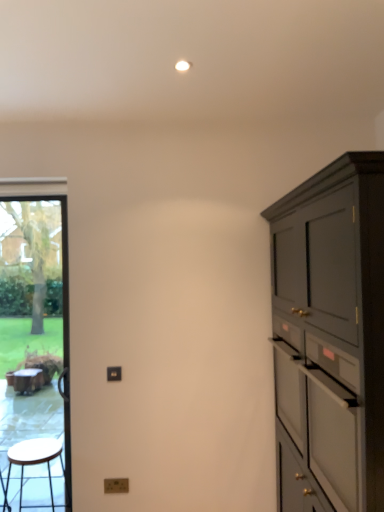
At what (x,y) coordinates should I click in order to perform the action: click on matte dark gray cabinet at right. Please return your answer as a coordinate pair (x, y). This screenshot has width=384, height=512. Looking at the image, I should click on (330, 337).

Identify the location of transparent glass door at left. This screenshot has width=384, height=512. (35, 323).

Measure the distance between transparent glass door at left and camera.

The depth of transparent glass door at left is 3.46 meters.

Locate an element on the screen. wooden stool at left is located at coordinates (34, 464).

From the image's perspective, is transparent glass door at left located beneath wooden stool at left?

No, from the image's perspective, transparent glass door at left is not beneath wooden stool at left.

Measure the distance from transparent glass door at left to wooden stool at left.

The distance of transparent glass door at left from wooden stool at left is 1.42 meters.

Who is shorter, transparent glass door at left or wooden stool at left?

wooden stool at left.

What's the angular difference between transparent glass door at left and wooden stool at left's facing directions?

They differ by 2.26 degrees in their facing directions.

Is point (369, 156) less distant than point (284, 429)?

Yes, point (369, 156) is closer to viewer.

From the image's perspective, is matte dark gray cabinet at right located above or below white matte drawer at right?

matte dark gray cabinet at right is situated lower than white matte drawer at right in the image.

Is matte dark gray cabinet at right to the left or to the right of white matte drawer at right in the image?

In the image, matte dark gray cabinet at right appears on the right side of white matte drawer at right.

Does matte dark gray cabinet at right turn towards white matte drawer at right?

Yes, matte dark gray cabinet at right is facing white matte drawer at right.

Does wooden stool at left turn towards matte dark gray cabinet at right?

No, wooden stool at left does not turn towards matte dark gray cabinet at right.

From the image's perspective, between wooden stool at left and matte dark gray cabinet at right, who is located below?

wooden stool at left appears lower in the image.

Is there a large distance between wooden stool at left and matte dark gray cabinet at right?

wooden stool at left is positioned a significant distance from matte dark gray cabinet at right.

Is wooden stool at left positioned beyond the bounds of matte dark gray cabinet at right?

Yes.

Is white matte drawer at right wider than transparent glass door at left?

Yes, white matte drawer at right is wider than transparent glass door at left.

Can you tell me how much white matte drawer at right and transparent glass door at left differ in facing direction?

There is a 90.3-degree angle between the facing directions of white matte drawer at right and transparent glass door at left.

Based on the photo, which object is closer to the camera, white matte drawer at right or transparent glass door at left?

white matte drawer at right is closer to the camera.

Which object is positioned more to the left, white matte drawer at right or transparent glass door at left?

Positioned to the left is transparent glass door at left.

Between white matte drawer at right and matte dark gray cabinet at right, which one appears on the right side from the viewer's perspective?

Positioned to the right is matte dark gray cabinet at right.

From the image's perspective, who appears lower, white matte drawer at right or matte dark gray cabinet at right?

matte dark gray cabinet at right, from the image's perspective.

In the scene shown: Is matte dark gray cabinet at right inside white matte drawer at right?

No, matte dark gray cabinet at right is not surrounded by white matte drawer at right.

Locate an element on the screen. drawer located above the matte dark gray cabinet at right (from a real-world perspective) is located at coordinates (315, 436).

From the picture: In terms of width, does wooden stool at left look wider or thinner when compared to transparent glass door at left?

Considering their sizes, wooden stool at left looks broader than transparent glass door at left.

Considering the relative positions of wooden stool at left and transparent glass door at left in the image provided, is wooden stool at left to the left or to the right of transparent glass door at left?

wooden stool at left is positioned on transparent glass door at left's right side.

Which is behind, wooden stool at left or transparent glass door at left?

transparent glass door at left is more distant.

From the image's perspective, is wooden stool at left below transparent glass door at left?

Yes, from the image's perspective, wooden stool at left is below transparent glass door at left.

Is matte dark gray cabinet at right beside transparent glass door at left?

There is a gap between matte dark gray cabinet at right and transparent glass door at left.

Considering the sizes of objects matte dark gray cabinet at right and transparent glass door at left in the image provided, who is thinner, matte dark gray cabinet at right or transparent glass door at left?

With smaller width is transparent glass door at left.

How many degrees apart are the facing directions of matte dark gray cabinet at right and transparent glass door at left?

The angular difference between matte dark gray cabinet at right and transparent glass door at left is 90.6 degrees.

Is matte dark gray cabinet at right positioned before transparent glass door at left?

Yes, matte dark gray cabinet at right is closer to the viewer.

Find the location of a particular element. The height and width of the screenshot is (512, 384). window screen on the left of wooden stool at left is located at coordinates (35, 323).

Locate an element on the screen. The image size is (384, 512). drawer above the matte dark gray cabinet at right (from a real-world perspective) is located at coordinates (315, 436).

Consider the image. From the image, which object appears to be farther from white matte drawer at right, matte dark gray cabinet at right or wooden stool at left?

wooden stool at left is positioned further to the anchor white matte drawer at right.

From the image, which object appears to be nearer to transparent glass door at left, matte dark gray cabinet at right or wooden stool at left?

The object closer to transparent glass door at left is wooden stool at left.

Looking at the image, which one is located further to transparent glass door at left, white matte drawer at right or wooden stool at left?

white matte drawer at right lies further to transparent glass door at left than the other object.

Looking at the image, which one is located closer to transparent glass door at left, matte dark gray cabinet at right or white matte drawer at right?

white matte drawer at right is positioned closer to the anchor transparent glass door at left.

From the picture: Considering their positions, is matte dark gray cabinet at right positioned closer to white matte drawer at right than transparent glass door at left?

The object closer to white matte drawer at right is matte dark gray cabinet at right.

Based on their spatial positions, is matte dark gray cabinet at right or transparent glass door at left closer to wooden stool at left?

Based on the image, transparent glass door at left appears to be nearer to wooden stool at left.

Estimate the real-world distances between objects in this image. Which object is closer to matte dark gray cabinet at right, transparent glass door at left or white matte drawer at right?

white matte drawer at right lies closer to matte dark gray cabinet at right than the other object.

Estimate the real-world distances between objects in this image. Which object is closer to matte dark gray cabinet at right, white matte drawer at right or wooden stool at left?

Among the two, white matte drawer at right is located nearer to matte dark gray cabinet at right.

I want to click on drawer between wooden stool at left and matte dark gray cabinet at right in the horizontal direction, so click(x=315, y=436).

Identify the location of drawer between transparent glass door at left and matte dark gray cabinet at right from left to right. (315, 436).

I want to click on stool between transparent glass door at left and matte dark gray cabinet at right in the horizontal direction, so click(x=34, y=464).

The image size is (384, 512). I want to click on stool between transparent glass door at left and white matte drawer at right, so click(x=34, y=464).